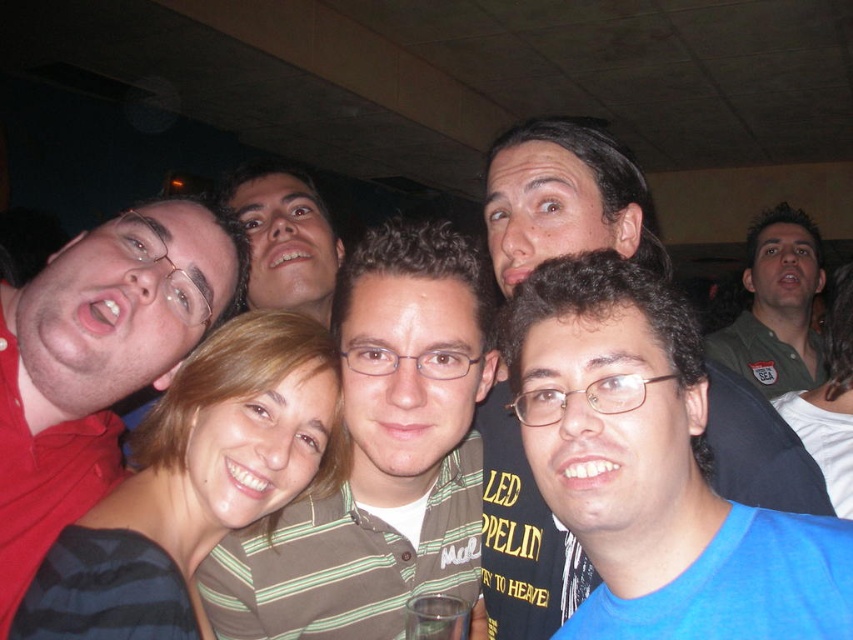
Is green striped shirt at center shorter than blue matte shirt at center?

Indeed, green striped shirt at center has a lesser height compared to blue matte shirt at center.

Between point (428, 246) and point (488, 611), which one is positioned behind?

The point (488, 611) is behind.

Where is `green striped shirt at center`? This screenshot has height=640, width=853. green striped shirt at center is located at coordinates (380, 456).

Is green striped shirt at center above matte red shirt at left?

No, green striped shirt at center is not above matte red shirt at left.

Image resolution: width=853 pixels, height=640 pixels. Describe the element at coordinates (380, 456) in the screenshot. I see `green striped shirt at center` at that location.

Between point (210, 596) and point (61, 355), which one is positioned in front?

Point (61, 355) is more forward.

Locate an element on the screen. The image size is (853, 640). green striped shirt at center is located at coordinates (380, 456).

Looking at this image, can you confirm if matte red shirt at left is positioned above green uniform shirt at upper right?

Incorrect, matte red shirt at left is not positioned above green uniform shirt at upper right.

Which is below, matte red shirt at left or green uniform shirt at upper right?

Positioned lower is matte red shirt at left.

Which is in front, point (227, 289) or point (740, 356)?

Point (227, 289)

Locate an element on the screen. Image resolution: width=853 pixels, height=640 pixels. matte red shirt at left is located at coordinates (97, 360).